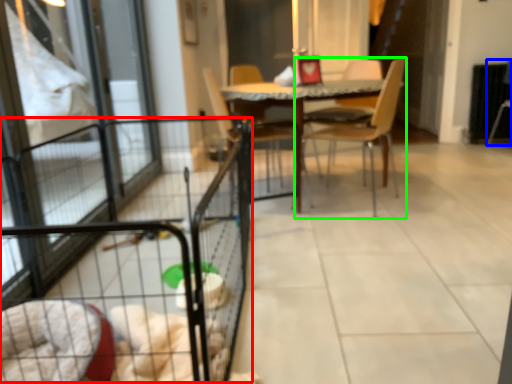
Question: Which is farther away from cage (highlighted by a red box)? armchair (highlighted by a blue box) or chair (highlighted by a green box)?

Choices:
 (A) armchair
 (B) chair

Answer: (A)